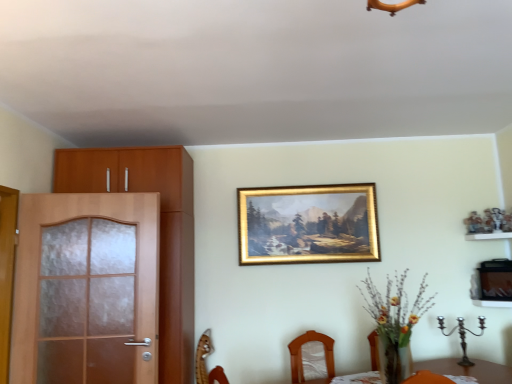
Question: Could gold/gilded picture frame at upper center be considered to be inside wooden chair at lower center?

Choices:
 (A) yes
 (B) no

Answer: (B)

Question: Is wooden chair at lower center positioned behind gold/gilded picture frame at upper center?

Choices:
 (A) yes
 (B) no

Answer: (B)

Question: Is the surface of wooden chair at lower center in direct contact with gold/gilded picture frame at upper center?

Choices:
 (A) no
 (B) yes

Answer: (A)

Question: Is wooden chair at lower center not close to gold/gilded picture frame at upper center?

Choices:
 (A) no
 (B) yes

Answer: (B)

Question: From a real-world perspective, is wooden chair at lower center below gold/gilded picture frame at upper center?

Choices:
 (A) no
 (B) yes

Answer: (B)

Question: From the image's perspective, is wooden chair at lower center located above gold/gilded picture frame at upper center?

Choices:
 (A) yes
 (B) no

Answer: (B)

Question: From a real-world perspective, is brown matte screen door at left located beneath wooden chair at lower center?

Choices:
 (A) no
 (B) yes

Answer: (A)

Question: Can you confirm if brown matte screen door at left is wider than wooden chair at lower center?

Choices:
 (A) yes
 (B) no

Answer: (A)

Question: Can you confirm if brown matte screen door at left is bigger than wooden chair at lower center?

Choices:
 (A) no
 (B) yes

Answer: (B)

Question: Does brown matte screen door at left have a lesser width compared to wooden chair at lower center?

Choices:
 (A) yes
 (B) no

Answer: (B)

Question: Does brown matte screen door at left come in front of wooden chair at lower center?

Choices:
 (A) no
 (B) yes

Answer: (B)

Question: Is the surface of brown matte screen door at left in direct contact with wooden chair at lower center?

Choices:
 (A) yes
 (B) no

Answer: (B)

Question: Is wooden shelf at right outside matte wood cabinet at left?

Choices:
 (A) yes
 (B) no

Answer: (A)